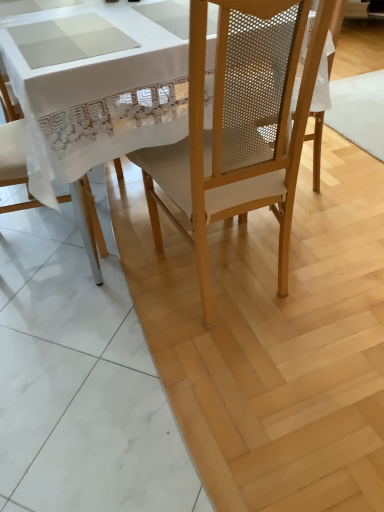
Where is `empty space that is in between matte wood chair at center, which is counted as the second chair, starting from the left, and white fabric chair at left, acting as the 2th chair starting from the right`? This screenshot has width=384, height=512. empty space that is in between matte wood chair at center, which is counted as the second chair, starting from the left, and white fabric chair at left, acting as the 2th chair starting from the right is located at coordinates point(116,264).